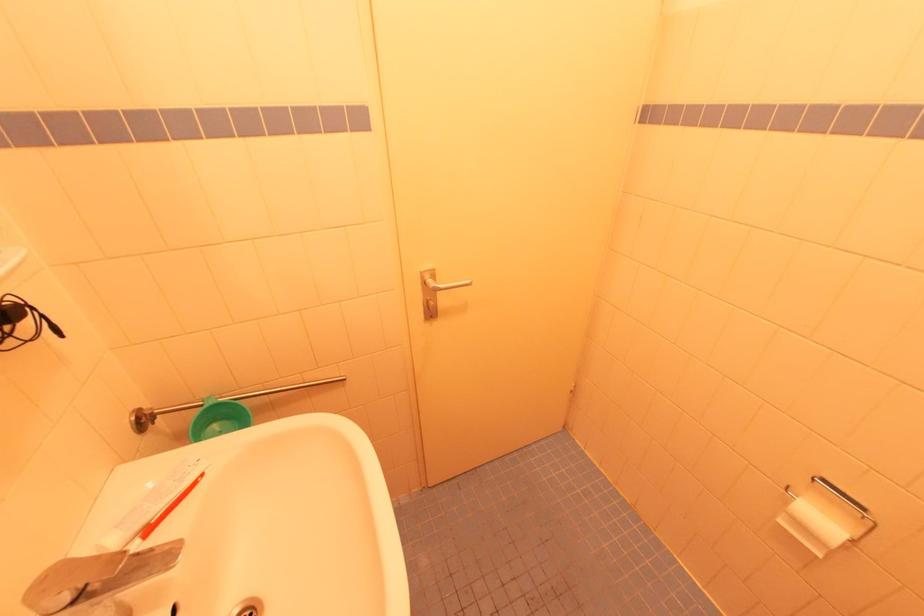
Identify the location of faucet handle. (96, 577).